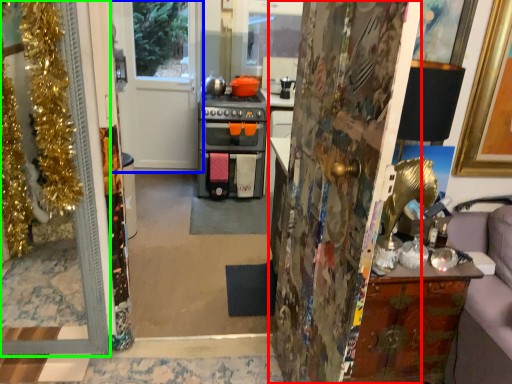
Question: Based on their relative distances, which object is nearer to door (highlighted by a red box)? Choose from door (highlighted by a blue box) and door (highlighted by a green box).

Choices:
 (A) door
 (B) door

Answer: (B)